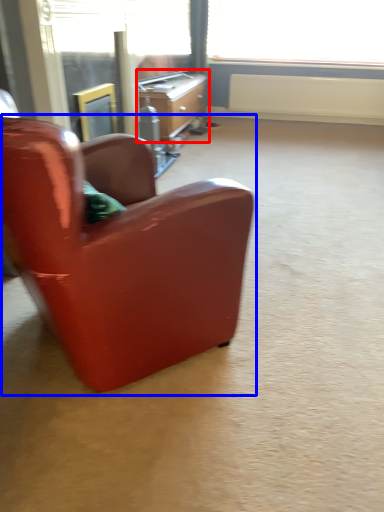
Question: Which of the following is the farthest to the observer, desk (highlighted by a red box) or chair (highlighted by a blue box)?

Choices:
 (A) desk
 (B) chair

Answer: (A)